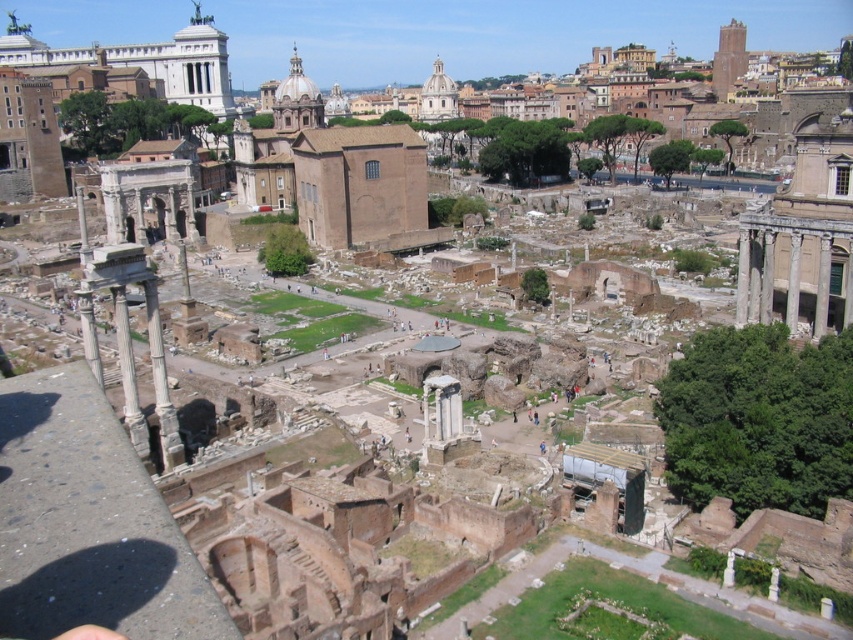
Based on the photo, you are a tourist standing at the Roman Forum. You see the smooth stone column at left and the smooth stone column at center right. If you want to take a photo that includes both columns in the frame, would their distance apart allow for this? Please consider the typical camera lens field of view.

The smooth stone column at left is 73.95 meters away from the smooth stone column at center right. A typical camera lens has a field of view of around 50 degrees, which can capture objects up to about 30 meters apart at a comfortable distance. Since the columns are 73.95 meters apart, they are too far apart to fit in a single photo with a standard lens without moving closer or using a wide angle lens.

You are standing at the Roman Forum and want to take a photo of the smooth stone column at right. If your camera has a maximum zoom range of 100 meters, will you be able to capture the column clearly without moving closer?

The smooth stone column at right is 102.82 meters away from the viewer. Since your camera can only zoom up to 100 meters, you will not be able to capture the column clearly without moving closer.